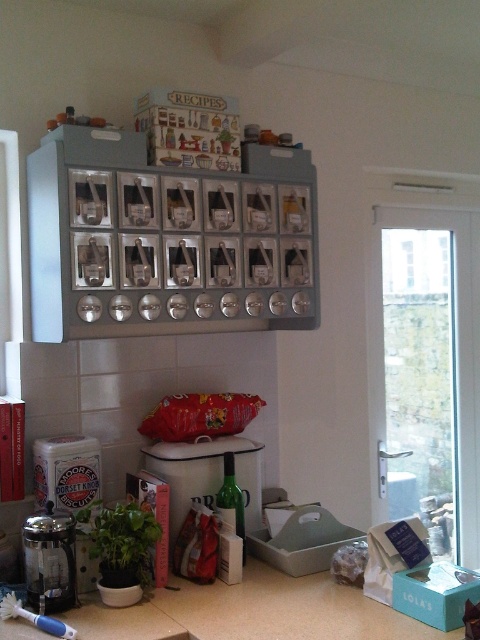
You are preparing breakfast and need to place a large plate on the available surfaces in the kitchen corner. Which object, the beige laminate countertop at lower center or the metallic glass coffee maker at lower left, can accommodate the large plate?

The beige laminate countertop at lower center has a larger size compared to the metallic glass coffee maker at lower left, so the large plate can be placed on the beige laminate countertop at lower center.

You are a barista preparing to place a large tray of coffee cups on the beige laminate countertop at lower center. The metallic glass coffee maker at lower left is currently in use. Is there enough space between the two to safely place the tray without disturbing the coffee maker?

The beige laminate countertop at lower center and metallic glass coffee maker at lower left are 12.51 inches apart. Since the tray requires more space than that, placing it might not be safe as the distance is insufficient.

You are preparing to place a new spice jar on the beige laminate countertop at lower center. However, there is already a matte white canister at center. Based on their positions, where should you place the spice jar to ensure it is not blocked by the canister?

The beige laminate countertop at lower center is positioned under the matte white canister at center, so placing the spice jar on the countertop below the canister would keep it visible and unobstructed.